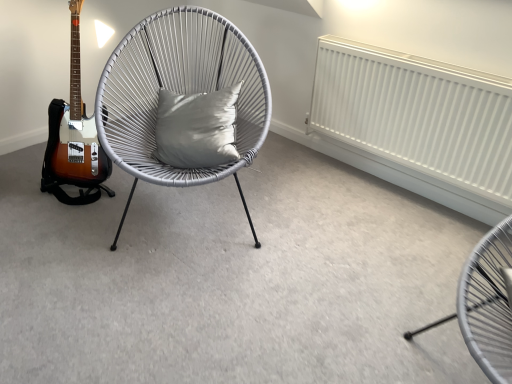
Locate an element on the screen. The image size is (512, 384). free spot in front of white woven chair at center, which is the first chair in back-to-front order is located at coordinates (175, 300).